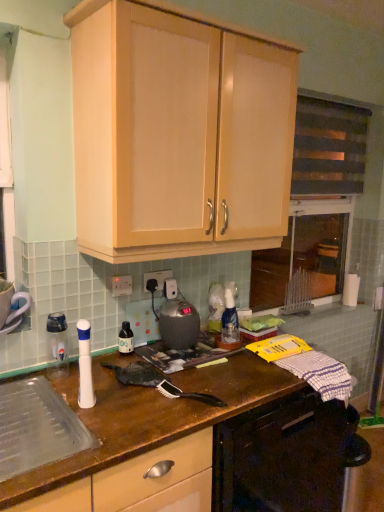
Question: In which direction should I rotate to look at white plastic electric outlet at center, the second electric outlet positioned from the left?

Choices:
 (A) right
 (B) left

Answer: (B)

Question: Can you see white plastic electric outlet at center, the second electric outlet positioned from the left, touching matte black bottle at center?

Choices:
 (A) no
 (B) yes

Answer: (A)

Question: From the image's perspective, is white plastic electric outlet at center, which is the first electric outlet in right-to-left order, beneath matte black bottle at center?

Choices:
 (A) yes
 (B) no

Answer: (B)

Question: Does white plastic electric outlet at center, the 1th electric outlet from the back, come behind matte black bottle at center?

Choices:
 (A) no
 (B) yes

Answer: (B)

Question: Can you confirm if white plastic electric outlet at center, acting as the second electric outlet starting from the front, is bigger than matte black bottle at center?

Choices:
 (A) no
 (B) yes

Answer: (A)

Question: Can we say white plastic electric outlet at center, the second electric outlet positioned from the left, lies outside matte black bottle at center?

Choices:
 (A) no
 (B) yes

Answer: (B)

Question: Is white plastic electric outlet at center, which is the first electric outlet in right-to-left order, facing away from matte black bottle at center?

Choices:
 (A) yes
 (B) no

Answer: (B)

Question: From a real-world perspective, does dark fabric window screen at upper right stand above white plastic electric outlet at center, positioned as the 1th electric outlet in left-to-right order?

Choices:
 (A) yes
 (B) no

Answer: (A)

Question: Are dark fabric window screen at upper right and white plastic electric outlet at center, the second electric outlet from the back, making contact?

Choices:
 (A) yes
 (B) no

Answer: (B)

Question: Is dark fabric window screen at upper right turned away from white plastic electric outlet at center, positioned as the 1th electric outlet in left-to-right order?

Choices:
 (A) no
 (B) yes

Answer: (A)

Question: Is dark fabric window screen at upper right bigger than white plastic electric outlet at center, the second electric outlet from the back?

Choices:
 (A) yes
 (B) no

Answer: (A)

Question: Would you say dark fabric window screen at upper right is a long distance from white plastic electric outlet at center, which ranks as the first electric outlet in front-to-back order?

Choices:
 (A) no
 (B) yes

Answer: (B)

Question: Considering the relative positions of dark fabric window screen at upper right and white plastic electric outlet at center, which ranks as the first electric outlet in front-to-back order, in the image provided, is dark fabric window screen at upper right to the right of white plastic electric outlet at center, which ranks as the first electric outlet in front-to-back order, from the viewer's perspective?

Choices:
 (A) no
 (B) yes

Answer: (B)

Question: Is clear plastic bottle at left far from matte wood cabinet at upper center?

Choices:
 (A) yes
 (B) no

Answer: (B)